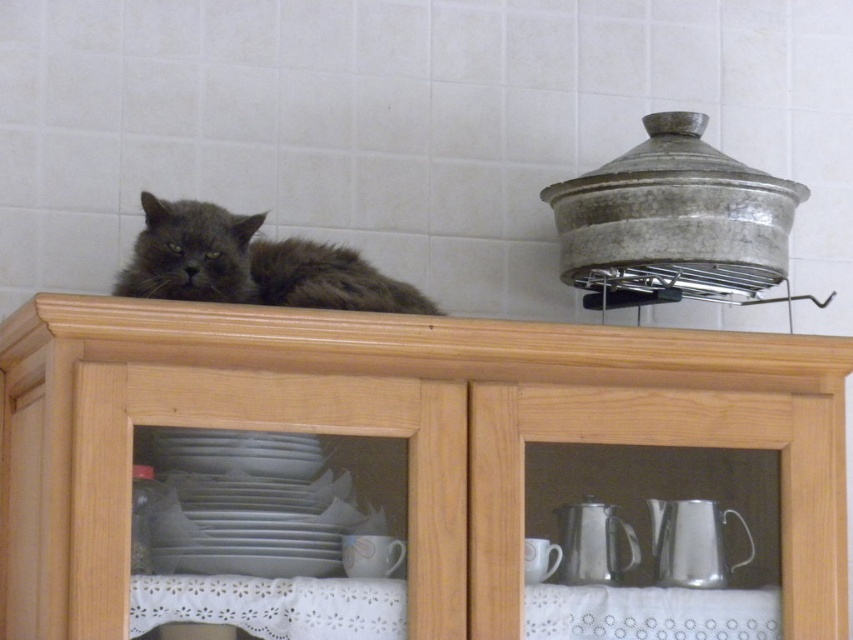
Based on the photo, you are a photographer trying to capture the fuzzy gray cat at upper center and the silver metallic teapot at lower right in the same frame. Based on their positions, which object is closer to the left edge of the image?

The fuzzy gray cat at upper center is positioned on the left side of the silver metallic teapot at lower right, so the fuzzy gray cat at upper center is closer to the left edge of the image.

You are a photographer trying to capture a clear photo of the brushed metal tea pot at lower center. However, the fuzzy gray cat at upper center is blocking your view. Can you move the cat to the side so you can take the photo?

The fuzzy gray cat at upper center is in front of the brushed metal tea pot at lower center, so moving the cat to the side would allow you to take a clear photo of the brushed metal tea pot at lower center.

You are a photographer trying to capture the fuzzy gray cat at upper center and the silver metallic teapot at lower right in the same frame. Based on their positions, which object is higher up in the image?

The fuzzy gray cat at upper center is located above the silver metallic teapot at lower right, so it is higher up in the image.